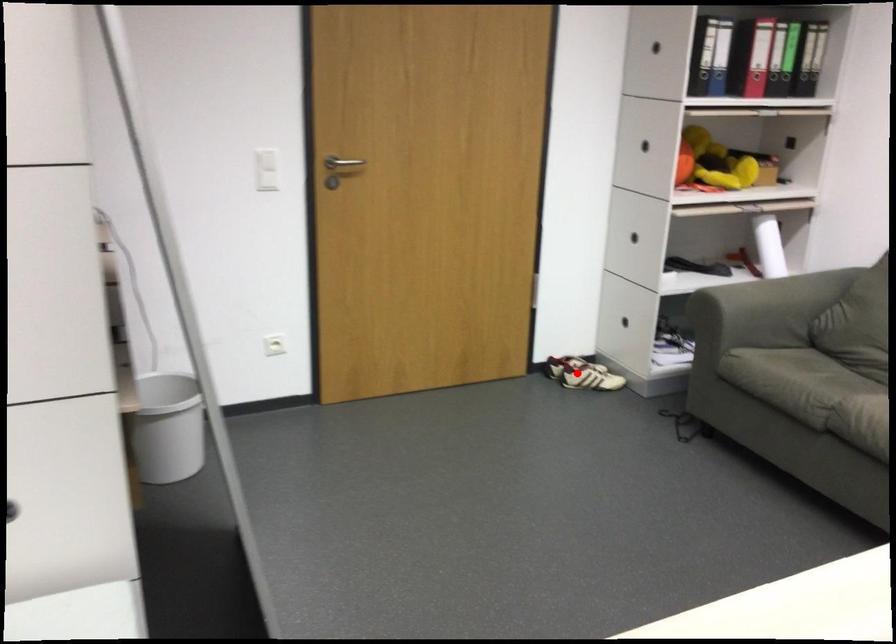
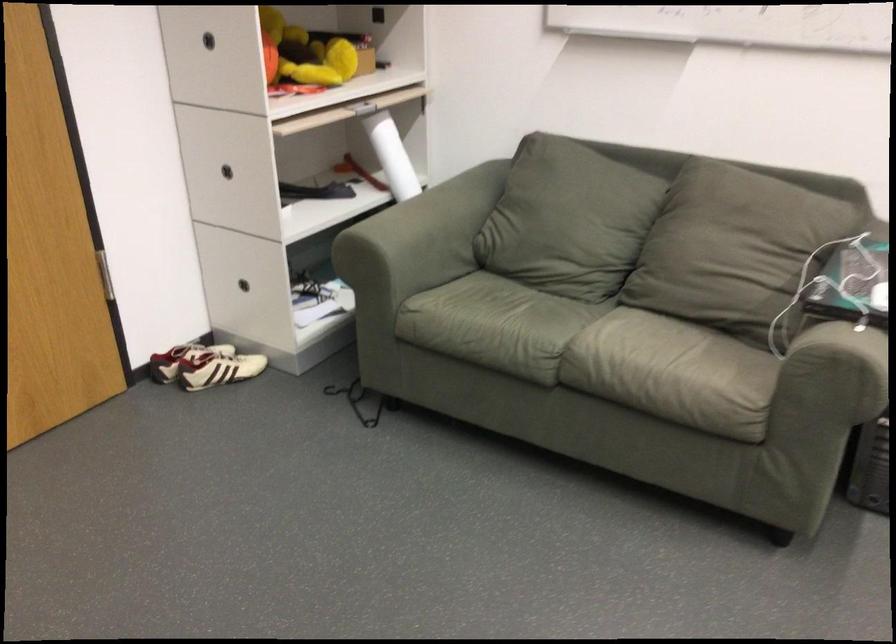
Where in the second image is the point corresponding to the highlighted location from the first image?

(218, 368)